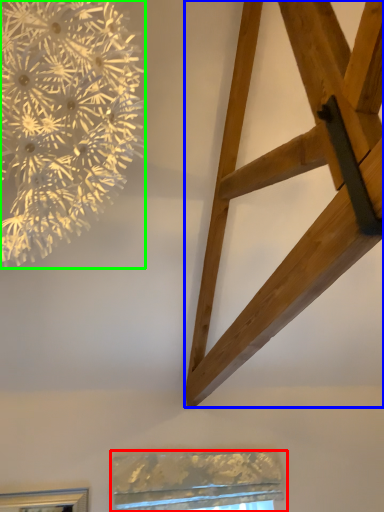
Question: Which is nearer to the window (highlighted by a red box)? furniture (highlighted by a blue box) or flower (highlighted by a green box).

Choices:
 (A) furniture
 (B) flower

Answer: (A)